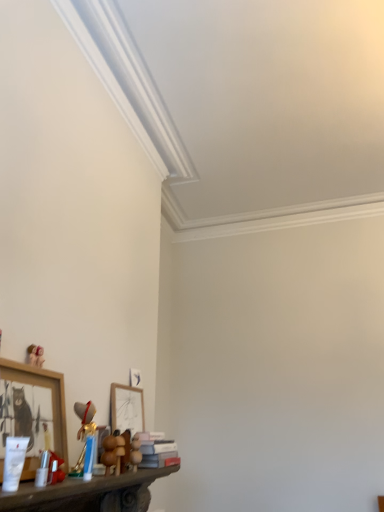
Question: From a real-world perspective, is wooden bear at lower center, acting as the 2th toy starting from the right, positioned under wooden picture frame at lower left, arranged as the 2th picture frame when viewed from the back, based on gravity?

Choices:
 (A) no
 (B) yes

Answer: (B)

Question: Can you confirm if wooden bear at lower center, the 2th toy in the top-to-bottom sequence, is thinner than wooden picture frame at lower left, which is the second picture frame from right to left?

Choices:
 (A) yes
 (B) no

Answer: (A)

Question: Does wooden bear at lower center, marked as the first toy in a front-to-back arrangement, have a smaller size compared to wooden picture frame at lower left, which is the 1th picture frame from left to right?

Choices:
 (A) yes
 (B) no

Answer: (A)

Question: Are wooden bear at lower center, acting as the 2th toy starting from the right, and wooden picture frame at lower left, which is the second picture frame from right to left, far apart?

Choices:
 (A) no
 (B) yes

Answer: (A)

Question: Could wooden picture frame at lower left, which is the 1th picture frame from left to right, be considered to be inside wooden bear at lower center, marked as the first toy in a front-to-back arrangement?

Choices:
 (A) no
 (B) yes

Answer: (A)

Question: Is wooden bear at lower center, which appears as the 2th toy when viewed from the left, positioned before wooden picture frame at lower left, arranged as the 2th picture frame when viewed from the back?

Choices:
 (A) no
 (B) yes

Answer: (A)

Question: Considering the relative sizes of brown plush bear at lower center, marked as the 3th toy in a top-to-bottom arrangement, and matte pink book at lower center in the image provided, is brown plush bear at lower center, marked as the 3th toy in a top-to-bottom arrangement, taller than matte pink book at lower center?

Choices:
 (A) yes
 (B) no

Answer: (A)

Question: Is matte pink book at lower center at the back of brown plush bear at lower center, positioned as the 1th toy in right-to-left order?

Choices:
 (A) yes
 (B) no

Answer: (B)

Question: Can you confirm if brown plush bear at lower center, which is the first toy from bottom to top, is positioned to the right of matte pink book at lower center?

Choices:
 (A) no
 (B) yes

Answer: (A)

Question: Is brown plush bear at lower center, the third toy from the left, at the left side of matte pink book at lower center?

Choices:
 (A) yes
 (B) no

Answer: (A)

Question: From the image's perspective, does brown plush bear at lower center, positioned as the 1th toy in right-to-left order, appear lower than matte pink book at lower center?

Choices:
 (A) no
 (B) yes

Answer: (A)

Question: Is brown plush bear at lower center, the third toy viewed from the front, facing towards matte pink book at lower center?

Choices:
 (A) yes
 (B) no

Answer: (B)

Question: Does matte white picture frame at center, which is the first picture frame from right to left, have a smaller size compared to matte pink teddy bear at lower left, marked as the first toy in a top-to-bottom arrangement?

Choices:
 (A) yes
 (B) no

Answer: (B)